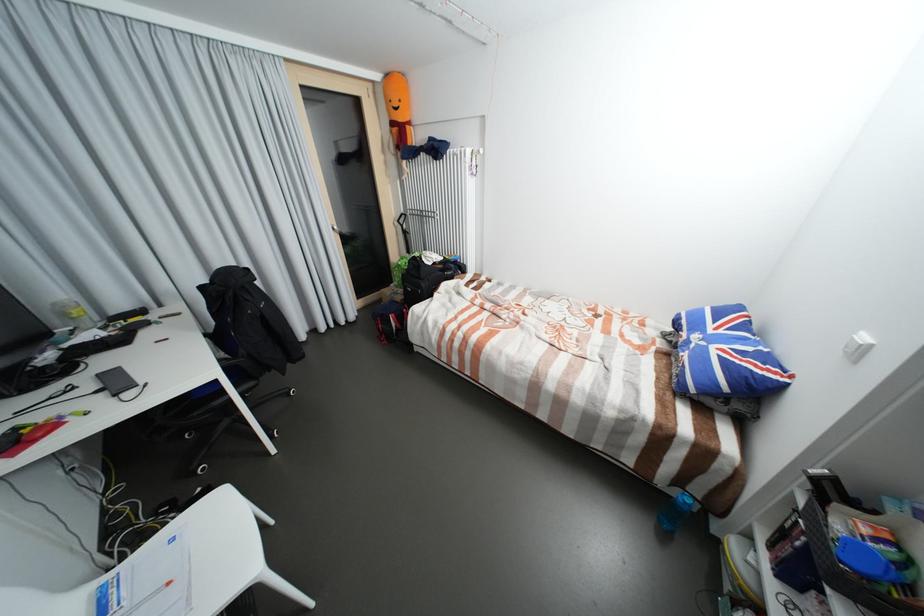
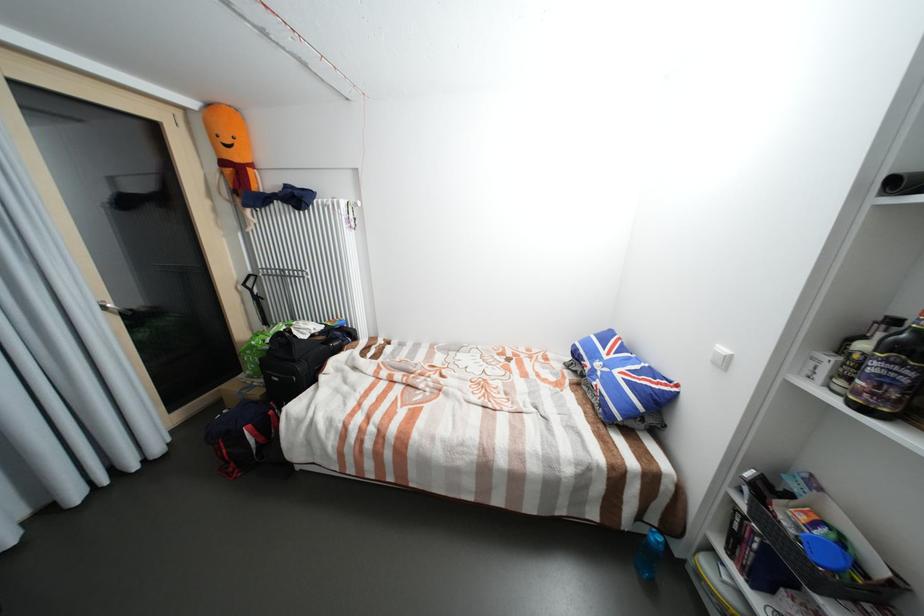
Where in the second image is the point corresponding to [857,560] from the first image?

(828, 560)